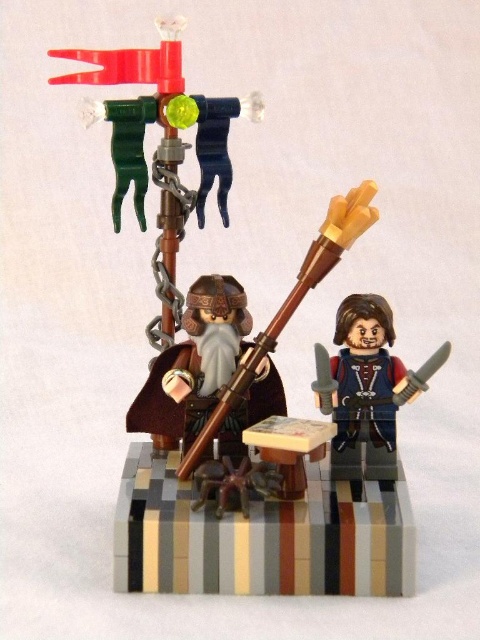
Is blue fabric vest at center above wooden spear at center?

No, blue fabric vest at center is not above wooden spear at center.

Who is positioned more to the right, blue fabric vest at center or wooden spear at center?

blue fabric vest at center

Who is more forward, (x=383, y=321) or (x=324, y=260)?

Point (x=324, y=260)

The height and width of the screenshot is (640, 480). In order to click on blue fabric vest at center in this screenshot , I will do `click(364, 388)`.